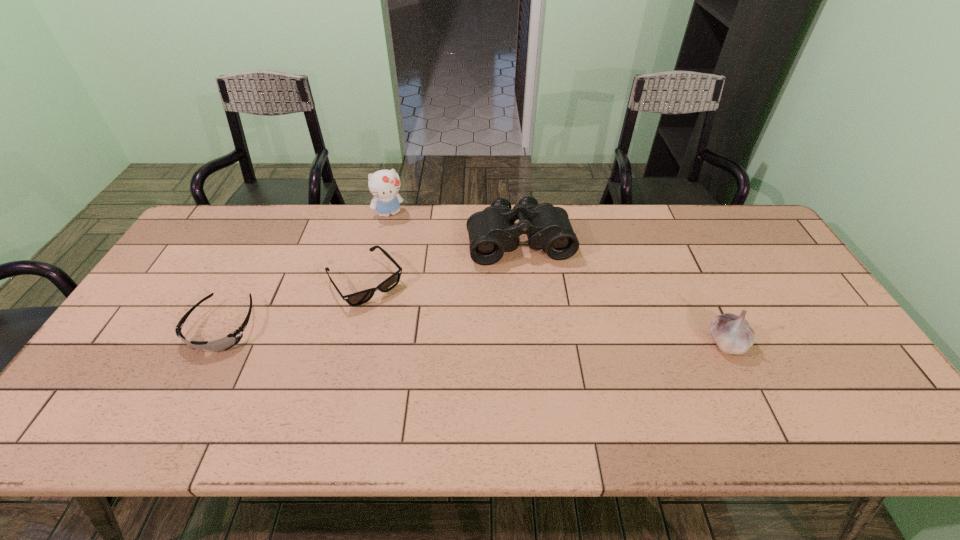
Identify the location of the leftmost object. This screenshot has width=960, height=540. (230, 340).

Locate an element on the screen. This screenshot has height=540, width=960. the shorter sunglasses is located at coordinates (230, 340).

I want to click on the rightmost object, so click(x=733, y=335).

I want to click on the tallest object, so click(x=384, y=184).

Identify the location of binoculars. Image resolution: width=960 pixels, height=540 pixels. (492, 232).

Where is `the right sunglasses`? This screenshot has width=960, height=540. the right sunglasses is located at coordinates (361, 297).

The image size is (960, 540). In order to click on the taller sunglasses in this screenshot , I will do `click(361, 297)`.

Image resolution: width=960 pixels, height=540 pixels. Identify the location of blank space located on the lenses of the leftmost object. (195, 381).

At what (x,y) coordinates should I click in order to perform the action: click on vacant region located 0.210m on the back of the garlic. Please return your answer as a coordinate pair (x, y). This screenshot has height=540, width=960. Looking at the image, I should click on (691, 270).

Locate an element on the screen. free region located 0.050m on the front-facing side of the kitten is located at coordinates (398, 231).